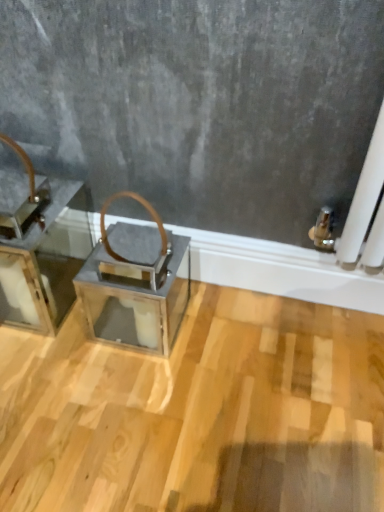
In order to click on metallic gray lantern at center in this screenshot , I will do `click(135, 298)`.

Describe the element at coordinates (135, 298) in the screenshot. This screenshot has height=512, width=384. I see `metallic gray lantern at center` at that location.

What do you see at coordinates (47, 260) in the screenshot? The image size is (384, 512). I see `metallic silver tray at left` at bounding box center [47, 260].

In order to click on metallic silver tray at left in this screenshot , I will do `click(47, 260)`.

Where is `metallic gray lantern at center`? This screenshot has width=384, height=512. metallic gray lantern at center is located at coordinates (135, 298).

Would you say metallic gray lantern at center is to the left or to the right of metallic silver tray at left in the picture?

metallic gray lantern at center is to the right of metallic silver tray at left.

Is metallic gray lantern at center positioned behind metallic silver tray at left?

Yes, metallic gray lantern at center is behind metallic silver tray at left.

Is point (85, 290) more distant than point (44, 296)?

Yes, it is.

From the image's perspective, does metallic gray lantern at center appear higher than metallic silver tray at left?

No, from the image's perspective, metallic gray lantern at center is not on top of metallic silver tray at left.

From a real-world perspective, does metallic gray lantern at center sit lower than metallic silver tray at left?

Yes, from a real-world perspective, metallic gray lantern at center is beneath metallic silver tray at left.

Considering the sizes of objects metallic gray lantern at center and metallic silver tray at left in the image provided, who is wider, metallic gray lantern at center or metallic silver tray at left?

With larger width is metallic silver tray at left.

From their relative heights in the image, would you say metallic gray lantern at center is taller or shorter than metallic silver tray at left?

metallic gray lantern at center is shorter than metallic silver tray at left.

Considering the sizes of objects metallic gray lantern at center and metallic silver tray at left in the image provided, who is bigger, metallic gray lantern at center or metallic silver tray at left?

metallic silver tray at left is bigger.

Is metallic gray lantern at center inside the boundaries of metallic silver tray at left, or outside?

metallic gray lantern at center is not inside metallic silver tray at left, it's outside.

Is there a large distance between metallic gray lantern at center and metallic silver tray at left?

metallic gray lantern at center is near metallic silver tray at left, not far away.

In the scene shown: Is metallic gray lantern at center positioned with its back to metallic silver tray at left?

No, metallic gray lantern at center's orientation is not away from metallic silver tray at left.

Can you tell me how much metallic gray lantern at center and metallic silver tray at left differ in facing direction?

metallic gray lantern at center and metallic silver tray at left are facing 0.000543 degrees away from each other.

This screenshot has height=512, width=384. I want to click on furniture above the metallic gray lantern at center (from the image's perspective), so click(x=47, y=260).

Would you say metallic silver tray at left is to the left or to the right of metallic gray lantern at center in the picture?

Based on their positions, metallic silver tray at left is located to the left of metallic gray lantern at center.

Between metallic silver tray at left and metallic gray lantern at center, which one is positioned behind?

metallic gray lantern at center is more distant.

Which is closer, (77, 270) or (130, 236)?

The point (130, 236) is closer.

From the image's perspective, is metallic silver tray at left located beneath metallic gray lantern at center?

No, from the image's perspective, metallic silver tray at left is not beneath metallic gray lantern at center.

Consider the image. From a real-world perspective, is metallic silver tray at left under metallic gray lantern at center?

No, from a real-world perspective, metallic silver tray at left is not beneath metallic gray lantern at center.

Considering the sizes of objects metallic silver tray at left and metallic gray lantern at center in the image provided, who is wider, metallic silver tray at left or metallic gray lantern at center?

metallic silver tray at left.

Can you confirm if metallic silver tray at left is taller than metallic gray lantern at center?

Correct, metallic silver tray at left is much taller as metallic gray lantern at center.

Looking at this image, based on their sizes in the image, would you say metallic silver tray at left is bigger or smaller than metallic gray lantern at center?

Considering their sizes, metallic silver tray at left takes up more space than metallic gray lantern at center.

Can we say metallic silver tray at left lies outside metallic gray lantern at center?

Yes.

Is metallic silver tray at left far from metallic gray lantern at center?

No, metallic silver tray at left is not far from metallic gray lantern at center.

Does metallic silver tray at left turn towards metallic gray lantern at center?

No.

This screenshot has width=384, height=512. I want to click on furniture above the metallic gray lantern at center (from a real-world perspective), so click(x=47, y=260).

Locate an element on the screen. This screenshot has width=384, height=512. furniture in front of the metallic gray lantern at center is located at coordinates (47, 260).

I want to click on table that is behind the metallic silver tray at left, so click(135, 298).